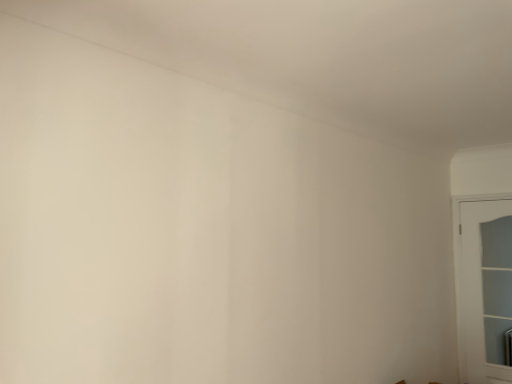
Image resolution: width=512 pixels, height=384 pixels. What do you see at coordinates (484, 289) in the screenshot? I see `white glossy door at right` at bounding box center [484, 289].

What are the coordinates of `white glossy door at right` in the screenshot? It's located at (484, 289).

Measure the distance between white glossy door at right and camera.

The distance of white glossy door at right from camera is 3.16 meters.

The image size is (512, 384). I want to click on white glossy door at right, so click(484, 289).